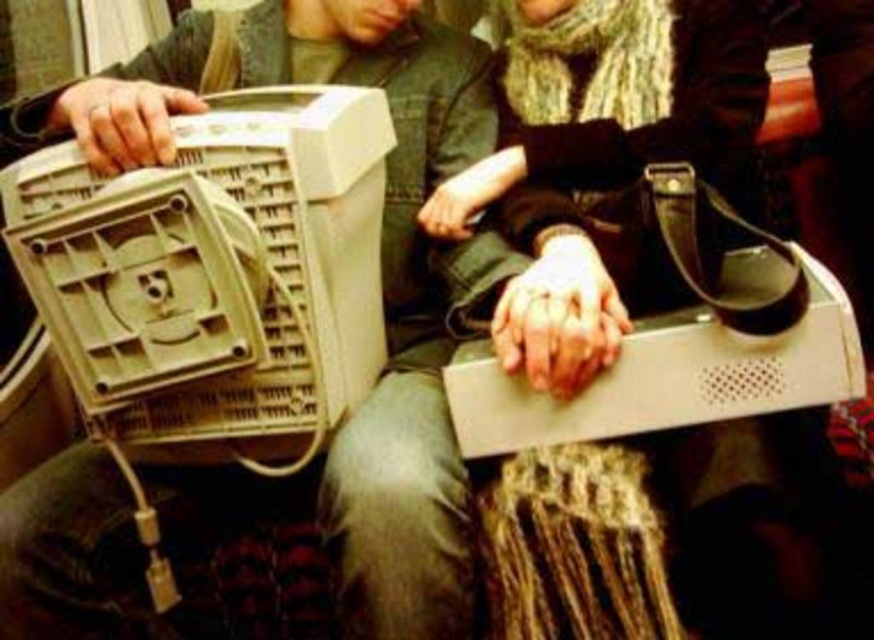
Is matte plastic monitor at left positioned before beige plastic computer at left?

No, matte plastic monitor at left is behind beige plastic computer at left.

Who is taller, matte plastic monitor at left or beige plastic computer at left?

matte plastic monitor at left

Locate an element on the screen. The width and height of the screenshot is (874, 640). matte plastic monitor at left is located at coordinates (399, 312).

Locate an element on the screen. matte plastic monitor at left is located at coordinates (399, 312).